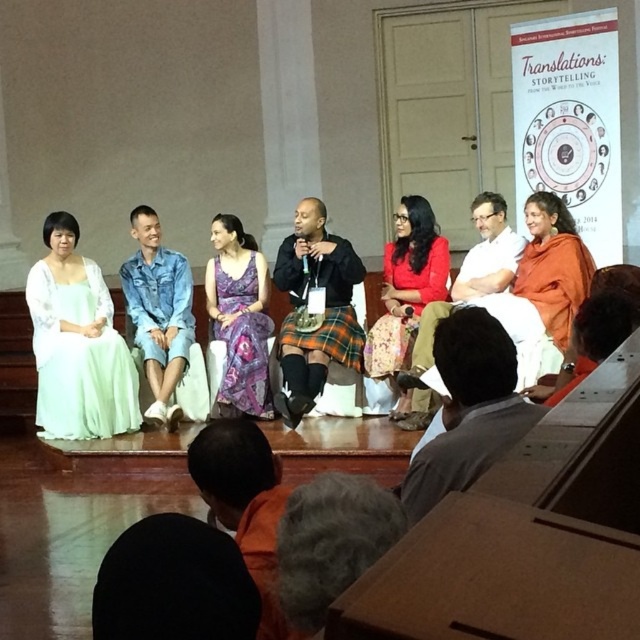
Question: Which of the following is the closest to the observer?

Choices:
 (A) matte orange robe at center
 (B) orange fabric at lower right
 (C) plaid fabric kilt at center
 (D) fuzzy gray hair at lower center

Answer: (D)

Question: Can you confirm if orange fabric at lower left is thinner than purple floral dress at center?

Choices:
 (A) no
 (B) yes

Answer: (B)

Question: Does fuzzy gray hair at lower center appear under orange fabric at lower right?

Choices:
 (A) yes
 (B) no

Answer: (A)

Question: Which point is closer to the camera?

Choices:
 (A) (168, 348)
 (B) (348, 355)

Answer: (B)

Question: Which point appears farthest from the camera in this image?

Choices:
 (A) (364, 365)
 (B) (65, 349)
 (C) (541, 396)

Answer: (A)

Question: Does orange fabric at lower left have a lesser width compared to denim jacket at center?

Choices:
 (A) no
 (B) yes

Answer: (B)